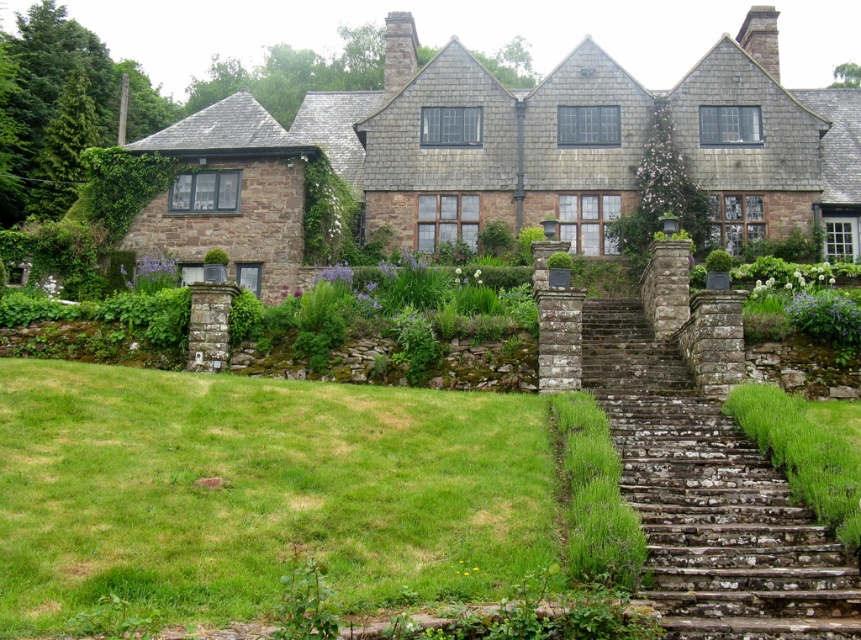
Which of these two, green grass at lower left or rusty stone stairs at right, stands taller?

With more height is rusty stone stairs at right.

Can you confirm if green grass at lower left is positioned to the left of rusty stone stairs at right?

Indeed, green grass at lower left is positioned on the left side of rusty stone stairs at right.

Is point (144, 444) positioned before point (663, 531)?

No, it is behind (663, 531).

Find the location of a particular element. The image size is (861, 640). green grass at lower left is located at coordinates (258, 492).

Does rusty stone stairs at right come in front of green mossy stone steps at lower right?

Yes.

Does point (663, 356) lie behind point (748, 397)?

Yes, it is behind point (748, 397).

The height and width of the screenshot is (640, 861). Identify the location of rusty stone stairs at right. (709, 499).

The image size is (861, 640). I want to click on rusty stone stairs at right, so click(x=709, y=499).

What do you see at coordinates (258, 492) in the screenshot?
I see `green grass at lower left` at bounding box center [258, 492].

Does point (56, 586) come farther from viewer compared to point (841, 513)?

No, (56, 586) is closer to viewer.

What are the coordinates of `green grass at lower left` in the screenshot? It's located at (258, 492).